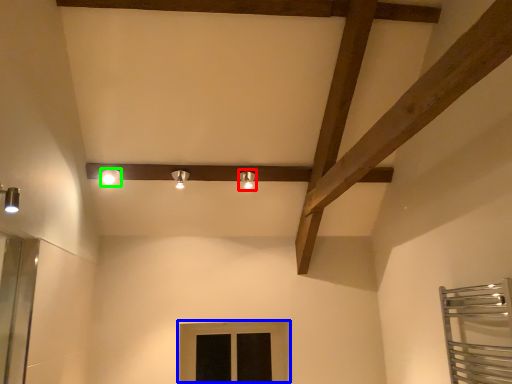
Question: Considering the real-world distances, which object is closest to light fixture (highlighted by a red box)? window (highlighted by a blue box) or light fixture (highlighted by a green box).

Choices:
 (A) window
 (B) light fixture

Answer: (B)